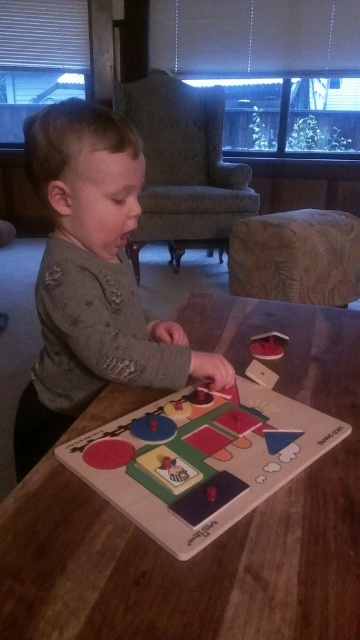
You are a parent standing next to the gray fabric toddler at center. You want to hand them a toy that is on the table. Can you reach them without moving your position?

The gray fabric toddler at center and viewer are 64.66 centimeters apart. Since the distance is within a typical reaching range, you can likely hand them the toy without moving.